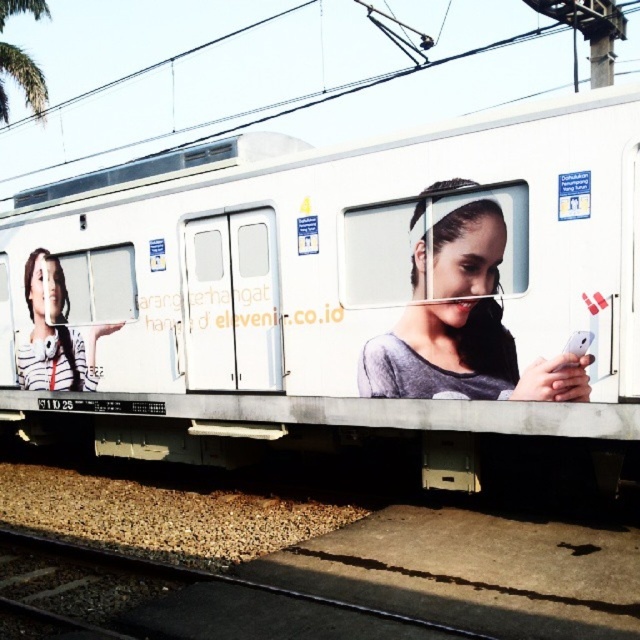
The width and height of the screenshot is (640, 640). In order to click on matte gray phone at center in this screenshot , I will do [x=461, y=324].

Who is positioned more to the right, matte gray phone at center or striped fabric shirt at left?

matte gray phone at center is more to the right.

At what (x,y) coordinates should I click in order to perform the action: click on matte gray phone at center. Please return your answer as a coordinate pair (x, y). This screenshot has width=640, height=640. Looking at the image, I should click on (461, 324).

Looking at this image, who is taller, white matte train at center or matte gray phone at center?

matte gray phone at center

Is white matte train at center further to camera compared to matte gray phone at center?

Yes.

Between point (145, 257) and point (493, 381), which one is positioned behind?

Positioned behind is point (145, 257).

The width and height of the screenshot is (640, 640). Find the location of `white matte train at center`. white matte train at center is located at coordinates (337, 294).

Who is shorter, matte gray phone at center or black asphalt train track at lower center?

With less height is black asphalt train track at lower center.

Who is more distant from viewer, (465, 234) or (396, 618)?

The point (465, 234) is more distant.

Which is in front, point (540, 376) or point (276, 586)?

Positioned in front is point (276, 586).

Locate an element on the screen. This screenshot has width=640, height=640. matte gray phone at center is located at coordinates (461, 324).